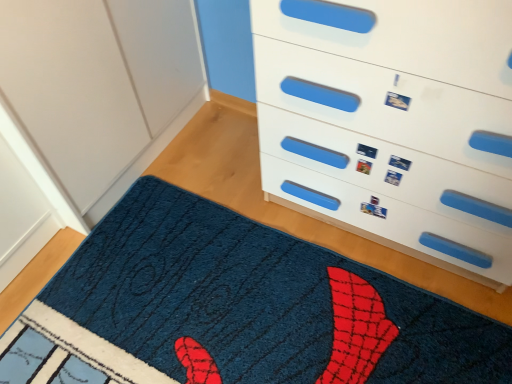
Question: Is blue shaggy mat at lower center inside white plastic chest of drawers at upper right?

Choices:
 (A) yes
 (B) no

Answer: (B)

Question: Does white plastic chest of drawers at upper right have a smaller size compared to blue shaggy mat at lower center?

Choices:
 (A) no
 (B) yes

Answer: (A)

Question: Is white plastic chest of drawers at upper right further to the viewer compared to blue shaggy mat at lower center?

Choices:
 (A) yes
 (B) no

Answer: (B)

Question: Is there a large distance between white plastic chest of drawers at upper right and blue shaggy mat at lower center?

Choices:
 (A) yes
 (B) no

Answer: (B)

Question: Is white plastic chest of drawers at upper right taller than blue shaggy mat at lower center?

Choices:
 (A) yes
 (B) no

Answer: (A)

Question: Is white plastic chest of drawers at upper right positioned with its back to blue shaggy mat at lower center?

Choices:
 (A) yes
 (B) no

Answer: (B)

Question: Is blue shaggy mat at lower center at the right side of white plastic chest of drawers at upper right?

Choices:
 (A) no
 (B) yes

Answer: (A)

Question: From a real-world perspective, is blue shaggy mat at lower center below white plastic chest of drawers at upper right?

Choices:
 (A) yes
 (B) no

Answer: (A)

Question: From the image's perspective, does blue shaggy mat at lower center appear higher than white plastic chest of drawers at upper right?

Choices:
 (A) no
 (B) yes

Answer: (A)

Question: Does blue shaggy mat at lower center have a greater width compared to white plastic chest of drawers at upper right?

Choices:
 (A) no
 (B) yes

Answer: (B)

Question: Is blue shaggy mat at lower center further to camera compared to white plastic chest of drawers at upper right?

Choices:
 (A) no
 (B) yes

Answer: (B)

Question: Considering the relative sizes of blue shaggy mat at lower center and white plastic chest of drawers at upper right in the image provided, is blue shaggy mat at lower center shorter than white plastic chest of drawers at upper right?

Choices:
 (A) yes
 (B) no

Answer: (A)

Question: Considering the positions of blue shaggy mat at lower center and white plastic chest of drawers at upper right in the image, is blue shaggy mat at lower center taller or shorter than white plastic chest of drawers at upper right?

Choices:
 (A) short
 (B) tall

Answer: (A)